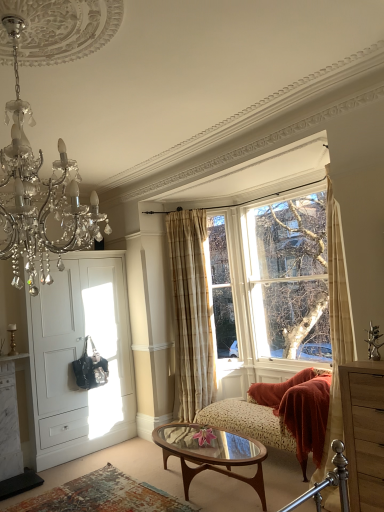
This screenshot has height=512, width=384. What do you see at coordinates (364, 432) in the screenshot?
I see `wooden dresser at right` at bounding box center [364, 432].

Measure the distance between point (347, 385) and camera.

Point (347, 385) and camera are 2.57 meters apart.

Find the location of `beige plaid curtain at center`. beige plaid curtain at center is located at coordinates (190, 313).

What do you see at coordinates (190, 313) in the screenshot? I see `beige plaid curtain at center` at bounding box center [190, 313].

What do you see at coordinates (280, 415) in the screenshot? I see `floral fabric studio couch at center` at bounding box center [280, 415].

At what (x,y) coordinates should I click in order to perform the action: click on translucent glass coffee table at center. Please return your answer as a coordinate pair (x, y). Looking at the image, I should click on (211, 453).

The image size is (384, 512). Find the location of `wooden dresser at right`. wooden dresser at right is located at coordinates (364, 432).

Which is nearer, [310,377] or [162,425]?

Positioned in front is point [310,377].

Looking at their sizes, would you say floral fabric studio couch at center is wider or thinner than translucent glass coffee table at center?

In the image, floral fabric studio couch at center appears to be wider than translucent glass coffee table at center.

Which object is positioned more to the left, floral fabric studio couch at center or translucent glass coffee table at center?

Positioned to the left is translucent glass coffee table at center.

How distant is floral fabric studio couch at center from translucent glass coffee table at center?

The distance of floral fabric studio couch at center from translucent glass coffee table at center is 20.02 inches.

In the scene shown: Which object is further away from the camera taking this photo, clear glass window at upper right or white matte door at left?

white matte door at left is further away from the camera.

Based on their sizes in the image, would you say clear glass window at upper right is bigger or smaller than white matte door at left?

In the image, clear glass window at upper right appears to be smaller than white matte door at left.

Are clear glass window at upper right and white matte door at left making contact?

clear glass window at upper right and white matte door at left are not in contact.

Is clear glass window at upper right at the right side of white matte door at left?

Indeed, clear glass window at upper right is positioned on the right side of white matte door at left.

Looking at the image, does crystal chandelier at upper left seem bigger or smaller compared to beige plaid curtain at center?

In the image, crystal chandelier at upper left appears to be larger than beige plaid curtain at center.

The image size is (384, 512). Identify the location of curtain located behind the crystal chandelier at upper left. (190, 313).

Is crystal chandelier at upper left in front of or behind beige plaid curtain at center in the image?

Clearly, crystal chandelier at upper left is in front of beige plaid curtain at center.

From a real-world perspective, who is located higher, crystal chandelier at upper left or beige plaid curtain at center?

crystal chandelier at upper left.

Which of these two, white matte door at left or wooden dresser at right, is wider?

Wider between the two is white matte door at left.

At what (x,y) coordinates should I click in order to perform the action: click on cabinetry below the white matte door at left (from a real-world perspective). Please return your answer as a coordinate pair (x, y). Looking at the image, I should click on (364, 432).

Are white matte door at left and wooden dresser at right beside each other?

No, white matte door at left is not in contact with wooden dresser at right.

Is floral fabric studio couch at center thinner than beige plaid curtain at center?

In fact, floral fabric studio couch at center might be wider than beige plaid curtain at center.

Considering their positions, is floral fabric studio couch at center located in front of or behind beige plaid curtain at center?

floral fabric studio couch at center is positioned closer to the viewer than beige plaid curtain at center.

How many degrees apart are the facing directions of floral fabric studio couch at center and beige plaid curtain at center?

The angle between the facing direction of floral fabric studio couch at center and the facing direction of beige plaid curtain at center is 51.4 degrees.

Is beige plaid curtain at center wider or thinner than crystal chandelier at upper left?

beige plaid curtain at center is thinner than crystal chandelier at upper left.

Locate an element on the screen. This screenshot has height=512, width=384. light fixture above the beige plaid curtain at center (from the image's perspective) is located at coordinates (39, 192).

Considering the positions of point (176, 280) and point (6, 31), is point (176, 280) closer or farther from the camera than point (6, 31)?

Point (176, 280) appears to be farther away from the viewer than point (6, 31).

Is point (202, 256) more distant than point (359, 426)?

That is True.

Find the location of a particular element. The width and height of the screenshot is (384, 512). cabinetry that is in front of the beige plaid curtain at center is located at coordinates (364, 432).

From their relative heights in the image, would you say beige plaid curtain at center is taller or shorter than wooden dresser at right?

In the image, beige plaid curtain at center appears to be taller than wooden dresser at right.

This screenshot has width=384, height=512. I want to click on coffee table located underneath the floral fabric studio couch at center (from a real-world perspective), so click(x=211, y=453).

Image resolution: width=384 pixels, height=512 pixels. In order to click on window located in front of the white matte door at left in this screenshot , I will do `click(275, 278)`.

Estimate the real-world distances between objects in this image. Which object is closer to floral fabric studio couch at center, white matte door at left or wooden dresser at right?

wooden dresser at right.

Estimate the real-world distances between objects in this image. Which object is further from floral fabric studio couch at center, translucent glass coffee table at center or clear glass window at upper right?

clear glass window at upper right is further to floral fabric studio couch at center.

Looking at the image, which one is located further to wooden dresser at right, crystal chandelier at upper left or white matte door at left?

The object further to wooden dresser at right is white matte door at left.

Estimate the real-world distances between objects in this image. Which object is further from translucent glass coffee table at center, floral fabric studio couch at center or beige plaid curtain at center?

beige plaid curtain at center.

Looking at this image, estimate the real-world distances between objects in this image. Which object is further from clear glass window at upper right, beige plaid curtain at center or crystal chandelier at upper left?

crystal chandelier at upper left.

When comparing their distances from translucent glass coffee table at center, does white matte door at left or floral fabric studio couch at center seem closer?

floral fabric studio couch at center is positioned closer to the anchor translucent glass coffee table at center.

Considering their positions, is crystal chandelier at upper left positioned closer to floral fabric studio couch at center than wooden dresser at right?

Among the two, wooden dresser at right is located nearer to floral fabric studio couch at center.

Considering their positions, is clear glass window at upper right positioned closer to crystal chandelier at upper left than wooden dresser at right?

wooden dresser at right.

You are a GUI agent. You are given a task and a screenshot of the screen. Output one action in this format:
    pyautogui.click(x=<x>, y=<y>)
    Task: Click on the studio couch between translucent glass coffee table at center and beige plaid curtain at center in the front-back direction
    This screenshot has width=384, height=512.
    Given the screenshot: What is the action you would take?
    pyautogui.click(x=280, y=415)

The image size is (384, 512). In order to click on window between wooden dresser at right and beige plaid curtain at center from front to back in this screenshot , I will do `click(275, 278)`.

Locate an element on the screen. coffee table between crystal chandelier at upper left and beige plaid curtain at center along the z-axis is located at coordinates pos(211,453).

Find the location of a particular element. studio couch that lies between crystal chandelier at upper left and translucent glass coffee table at center from top to bottom is located at coordinates pos(280,415).